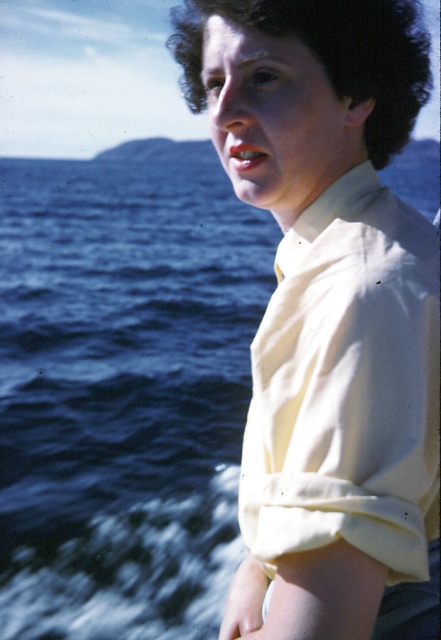
Describe the element at coordinates (329, 312) in the screenshot. The width and height of the screenshot is (441, 640). I see `white matte shirt at upper right` at that location.

Does point (396, 260) come closer to viewer compared to point (384, 557)?

No, (396, 260) is behind (384, 557).

Where is `white matte shirt at upper right`? This screenshot has width=441, height=640. white matte shirt at upper right is located at coordinates pos(329,312).

Is white matte shirt at upper right further to camera compared to dark curly hair at upper center?

No, white matte shirt at upper right is closer to the viewer.

This screenshot has height=640, width=441. I want to click on white matte shirt at upper right, so click(329, 312).

Who is lower down, white cotton shirt at right or dark curly hair at upper center?

white cotton shirt at right is below.

Consider the image. Can you confirm if white cotton shirt at right is smaller than dark curly hair at upper center?

Indeed, white cotton shirt at right has a smaller size compared to dark curly hair at upper center.

Locate an element on the screen. This screenshot has width=441, height=640. white cotton shirt at right is located at coordinates (347, 385).